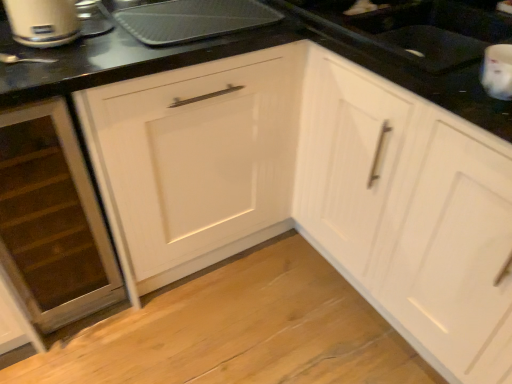
This screenshot has height=384, width=512. What are the coordinates of `free space in front of matte silver toaster at upper left` in the screenshot? It's located at (58, 62).